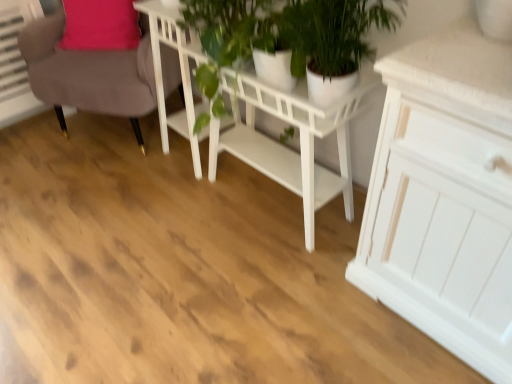
Question: Is the surface of white glossy table at center, which is counted as the first table, starting from the right, in direct contact with white wooden table at center, placed as the 1th table when sorted from left to right?

Choices:
 (A) no
 (B) yes

Answer: (A)

Question: From a real-world perspective, is white glossy table at center, the 2th table viewed from the left, located higher than white wooden table at center, placed as the second table when sorted from right to left?

Choices:
 (A) no
 (B) yes

Answer: (A)

Question: Can you confirm if white glossy table at center, the 2th table viewed from the left, is smaller than white wooden table at center, placed as the 1th table when sorted from left to right?

Choices:
 (A) no
 (B) yes

Answer: (A)

Question: From the image's perspective, is white glossy table at center, the 2th table viewed from the left, over white wooden table at center, placed as the second table when sorted from right to left?

Choices:
 (A) no
 (B) yes

Answer: (A)

Question: Is the depth of white glossy table at center, which is counted as the first table, starting from the right, greater than that of white wooden table at center, placed as the second table when sorted from right to left?

Choices:
 (A) yes
 (B) no

Answer: (B)

Question: Can you confirm if white glossy table at center, which is counted as the first table, starting from the right, is positioned to the left of white wooden table at center, placed as the 1th table when sorted from left to right?

Choices:
 (A) no
 (B) yes

Answer: (A)

Question: Is white glossy pot at center completely or partially outside of suede-like brown chair at upper left?

Choices:
 (A) no
 (B) yes

Answer: (B)

Question: Can you confirm if white glossy pot at center is positioned to the right of suede-like brown chair at upper left?

Choices:
 (A) yes
 (B) no

Answer: (A)

Question: Does white glossy pot at center lie behind suede-like brown chair at upper left?

Choices:
 (A) yes
 (B) no

Answer: (B)

Question: From the image's perspective, is white glossy pot at center located above suede-like brown chair at upper left?

Choices:
 (A) no
 (B) yes

Answer: (A)

Question: Is white glossy pot at center taller than suede-like brown chair at upper left?

Choices:
 (A) no
 (B) yes

Answer: (A)

Question: From a real-world perspective, is white glossy pot at center physically above suede-like brown chair at upper left?

Choices:
 (A) no
 (B) yes

Answer: (B)

Question: Are green leafy plant at center and white glossy pot at center beside each other?

Choices:
 (A) no
 (B) yes

Answer: (B)